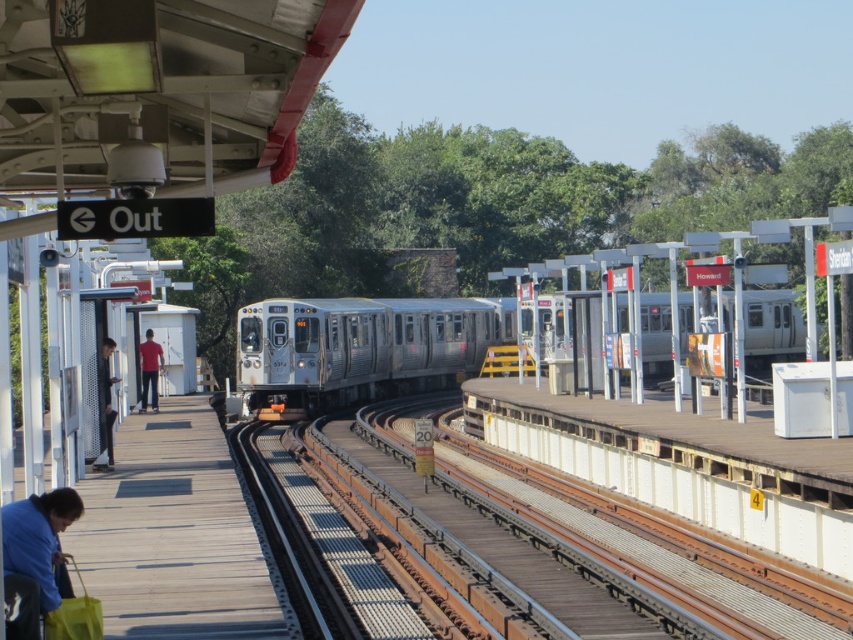
Question: Which object is closer to the camera taking this photo?

Choices:
 (A) silver metallic train at center
 (B) matte red shirt at left
 (C) blue fabric bag at lower left
 (D) wooden platform at lower left

Answer: (C)

Question: Estimate the real-world distances between objects in this image. Which object is closer to the matte red shirt at left?

Choices:
 (A) dark gray suit at left
 (B) blue fabric bag at lower left

Answer: (A)

Question: Is the position of silver metallic train at center less distant than that of blue fabric bag at lower left?

Choices:
 (A) no
 (B) yes

Answer: (A)

Question: Which of these objects is positioned farthest from the silver metallic train at center?

Choices:
 (A) blue fabric bag at lower left
 (B) matte red shirt at left

Answer: (A)

Question: Can you confirm if blue fabric bag at lower left is bigger than matte red shirt at left?

Choices:
 (A) yes
 (B) no

Answer: (B)

Question: Does silver metallic train at center appear on the right side of matte red shirt at left?

Choices:
 (A) yes
 (B) no

Answer: (A)